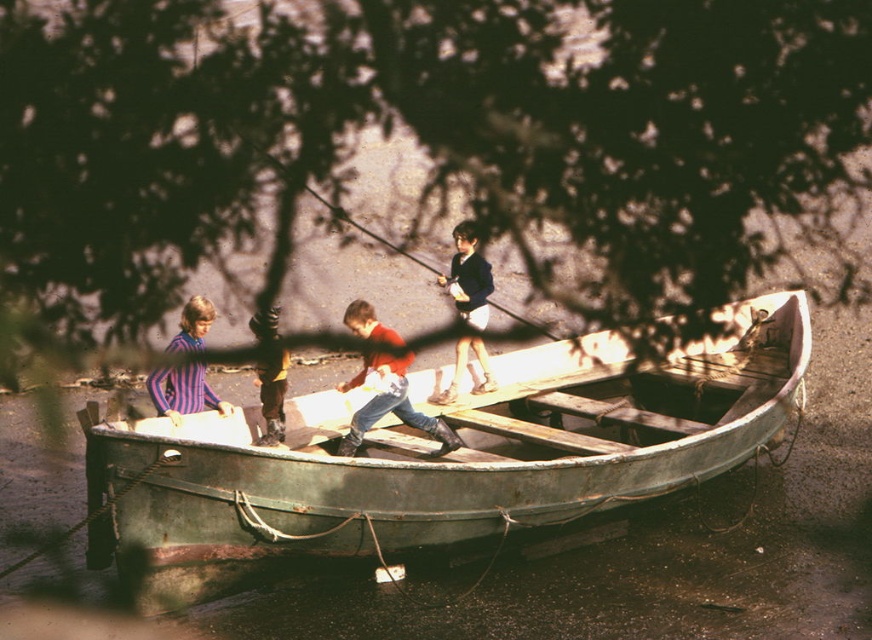
Question: Does green wooden boat at center have a larger size compared to red matte shirt at center?

Choices:
 (A) no
 (B) yes

Answer: (A)

Question: Does green wooden boat at center have a smaller size compared to red matte shirt at center?

Choices:
 (A) yes
 (B) no

Answer: (A)

Question: Which of the following is the closest to the observer?

Choices:
 (A) (473, 260)
 (B) (597, 378)
 (C) (213, 396)
 (D) (438, 424)

Answer: (D)

Question: Among these points, which one is nearest to the camera?

Choices:
 (A) (274, 436)
 (B) (128, 474)
 (C) (168, 412)
 (D) (366, 307)

Answer: (B)

Question: Which point is farther to the camera?

Choices:
 (A) striped fabric shirt at left
 (B) red matte shirt at center
 (C) yellow fabric pants at center

Answer: (C)

Question: Does striped fabric shirt at left have a lesser width compared to yellow fabric pants at center?

Choices:
 (A) yes
 (B) no

Answer: (B)